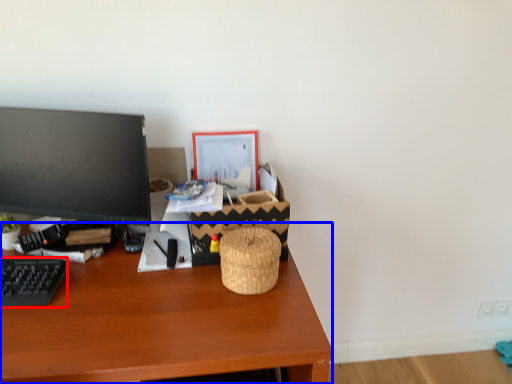
Question: Which object appears farthest to the camera in this image, computer keyboard (highlighted by a red box) or desk (highlighted by a blue box)?

Choices:
 (A) computer keyboard
 (B) desk

Answer: (A)